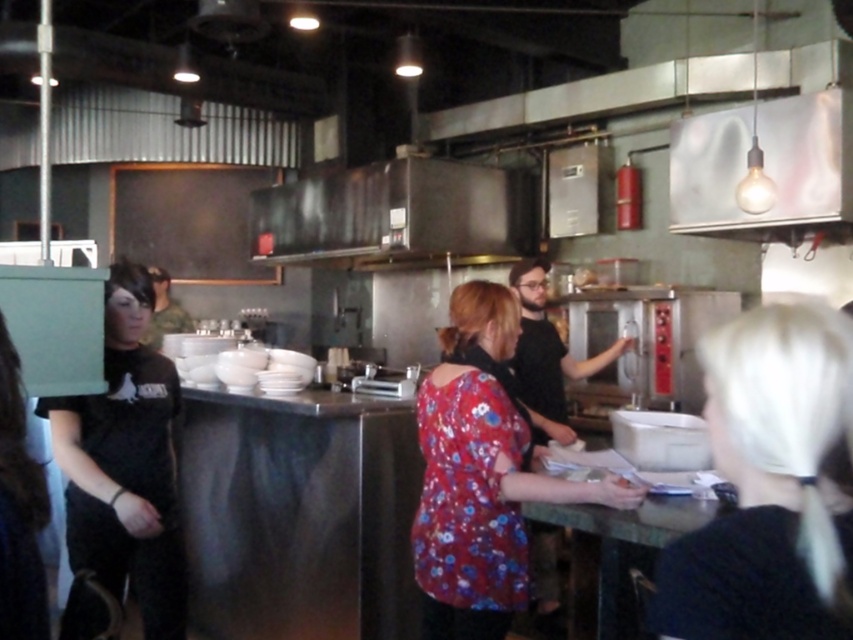
You are a customer in this kitchen and you want to ask the person in the floral fabric blouse at center a question. Which direction should you walk to approach them from the matte black shirt at left?

The floral fabric blouse at center is positioned under the matte black shirt at left, so you should walk downward from the matte black shirt at left to reach the floral fabric blouse at center.

You are standing in the kitchen and need to reach both the point at coordinates (822,573) and the point at (109,579). Which point should you move towards first if you want to reach the one closer to you?

You should move towards point (822,573) first because it is closer to you than point (109,579).